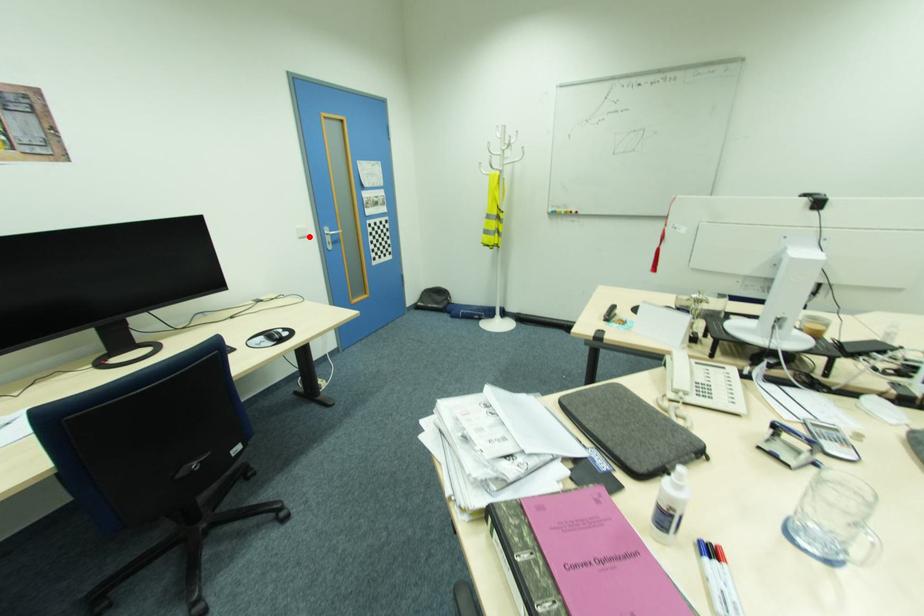
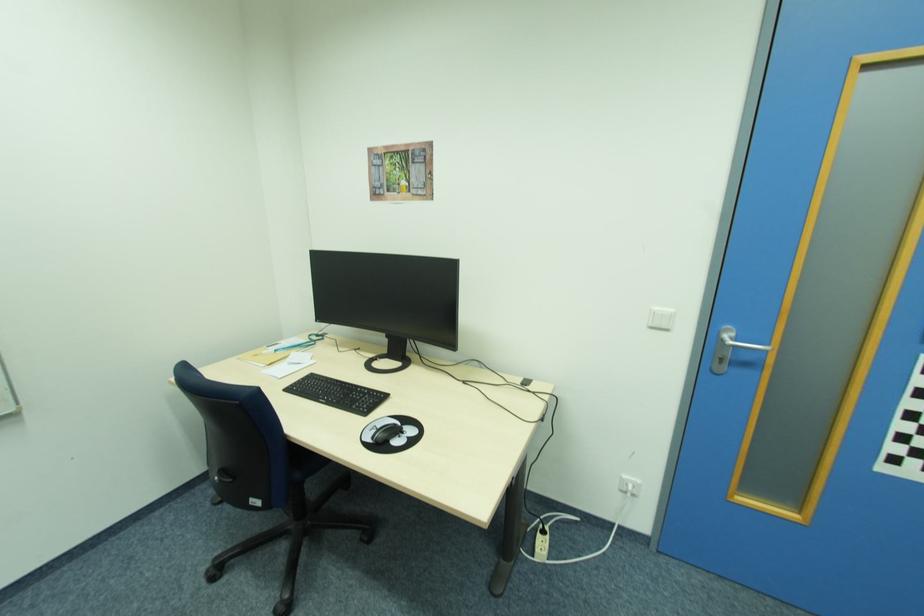
Locate, in the second image, the point that corresponds to the highlighted location in the first image.

(670, 329)